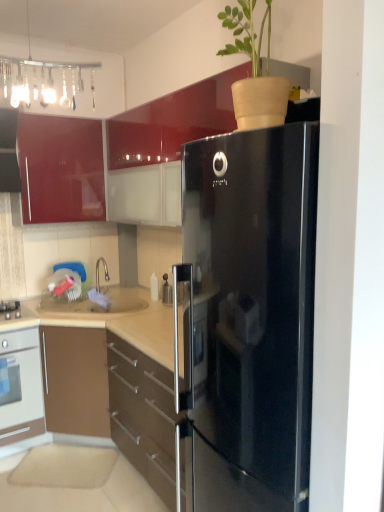
Question: Relative to glossy red cabinet at upper left, arranged as the second cabinetry when ordered from the bottom, is brown glossy cabinet at lower left, arranged as the second cabinetry when viewed from the top, in front or behind?

Choices:
 (A) front
 (B) behind

Answer: (A)

Question: From the image's perspective, is brown glossy cabinet at lower left, arranged as the second cabinetry when viewed from the top, positioned above or below glossy red cabinet at upper left, arranged as the second cabinetry when ordered from the bottom?

Choices:
 (A) above
 (B) below

Answer: (B)

Question: Estimate the real-world distances between objects in this image. Which object is farther from the brown glossy cabinet at lower left, arranged as the second cabinetry when viewed from the top?

Choices:
 (A) glossy red cabinet at upper left, which is counted as the first cabinetry, starting from the top
 (B) white glossy oven at lower left

Answer: (A)

Question: Estimate the real-world distances between objects in this image. Which object is closer to the glossy red cabinet at upper left, which is counted as the first cabinetry, starting from the top?

Choices:
 (A) brown glossy cabinet at lower left, the first cabinetry positioned from the bottom
 (B) white glossy oven at lower left

Answer: (B)